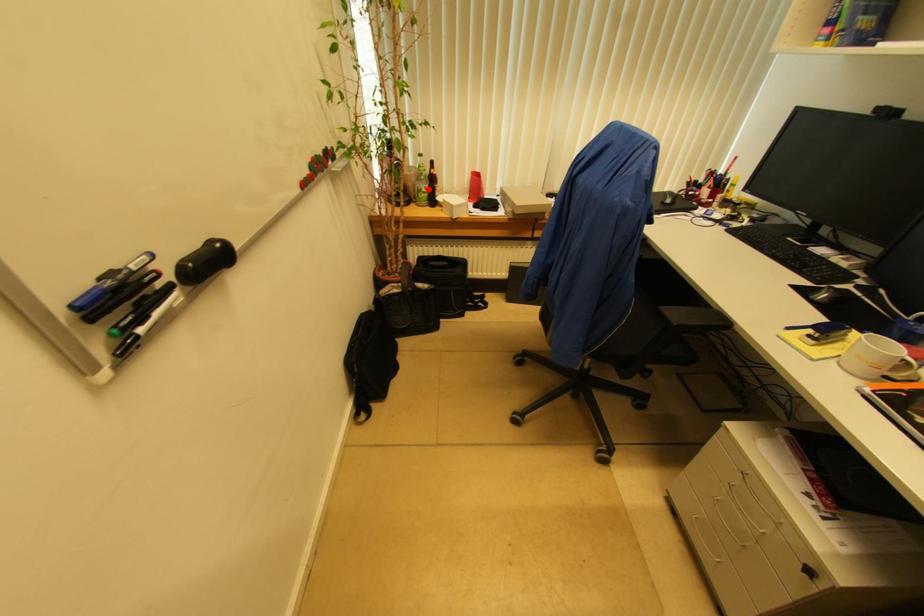
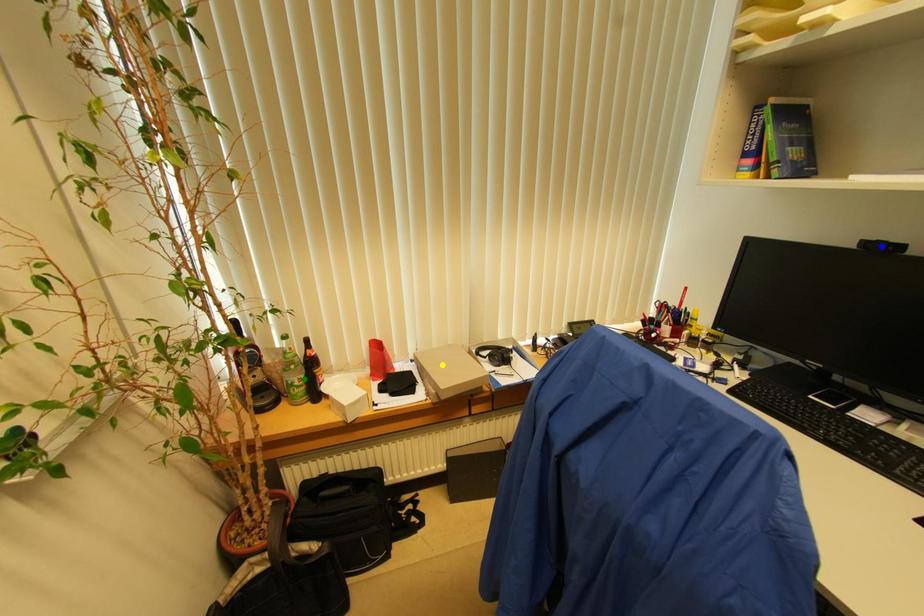
Question: I am providing you with two images of the same scene from different viewpoints. A red point is marked on the first image. You are given multiple points on the second image. Which point in image 2 is actually the same real-world point as the red point in image 1?

Choices:
 (A) yellow point
 (B) blue point
 (C) green point

Answer: (C)